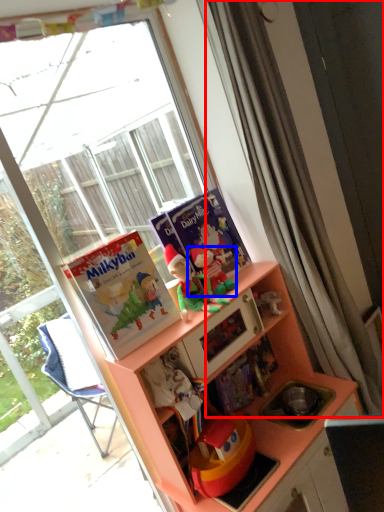
Question: Which object is further to the camera taking this photo, curtain (highlighted by a red box) or toy (highlighted by a blue box)?

Choices:
 (A) curtain
 (B) toy

Answer: (B)